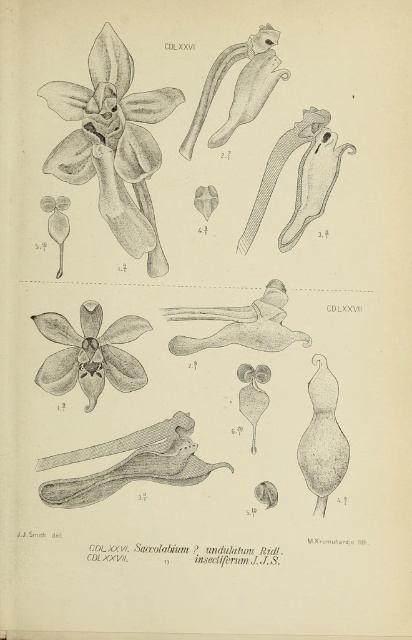
Which is more to the right, black line drawing orchid at upper left or smooth gray stem at lower center?

Positioned to the right is black line drawing orchid at upper left.

Can you confirm if black line drawing orchid at upper left is positioned below smooth gray stem at lower center?

No, black line drawing orchid at upper left is not below smooth gray stem at lower center.

You are a GUI agent. You are given a task and a screenshot of the screen. Output one action in this format:
    pyautogui.click(x=<x>, y=<y>)
    Task: Click on the black line drawing orchid at upper left
    
    Given the screenshot: What is the action you would take?
    pyautogui.click(x=114, y=144)

Identify the location of black line drawing orchid at upper left. Image resolution: width=412 pixels, height=640 pixels. (114, 144).

Based on the photo, is smooth gray stem at lower center positioned before matte black orchid at center?

Yes.

Can you confirm if smooth gray stem at lower center is taller than matte black orchid at center?

No, smooth gray stem at lower center is not taller than matte black orchid at center.

Which is in front, point (170, 480) or point (121, 376)?

Point (170, 480) is in front.

Locate an element on the screen. The height and width of the screenshot is (640, 412). smooth gray stem at lower center is located at coordinates (130, 464).

Which is more to the left, matte black orchid at upper left or matte black orchid at center?

matte black orchid at center is more to the left.

Which is in front, point (77, 141) or point (126, 380)?

Point (77, 141)

At what (x,y) coordinates should I click in order to perform the action: click on matte black orchid at upper left. Please return your answer as a coordinate pair (x, y). The height and width of the screenshot is (640, 412). Looking at the image, I should click on (112, 144).